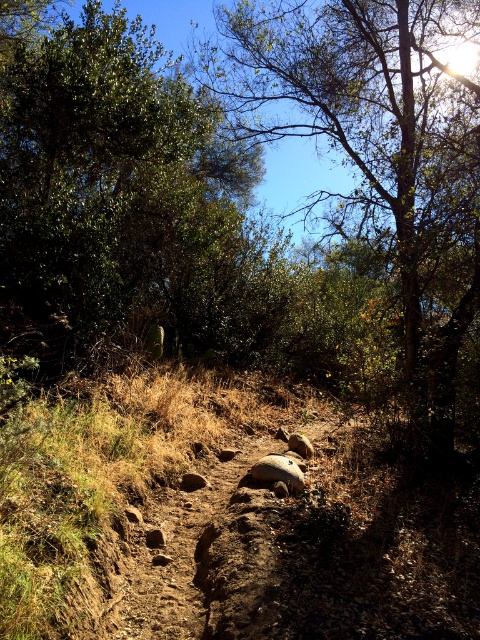
Question: Where is green leafy tree at upper left located in relation to green leafy tree at center in the image?

Choices:
 (A) right
 (B) left

Answer: (B)

Question: Which point is closer to the camera?

Choices:
 (A) green leafy tree at center
 (B) green leafy tree at upper left

Answer: (A)

Question: Is green leafy tree at upper left positioned in front of green leafy tree at center?

Choices:
 (A) yes
 (B) no

Answer: (B)

Question: Is green leafy tree at upper left smaller than green leafy tree at center?

Choices:
 (A) no
 (B) yes

Answer: (B)